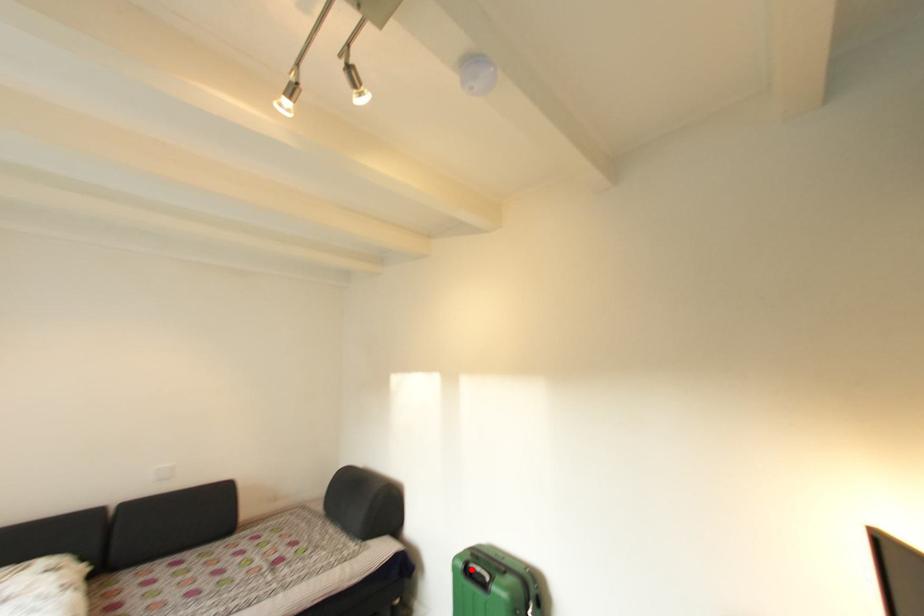
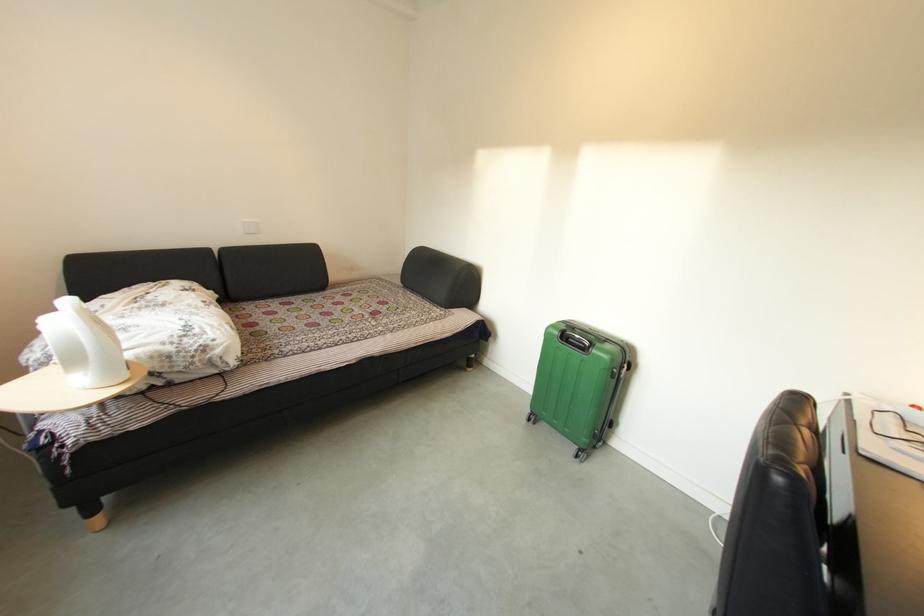
Find the pixel in the second image that matches the highlighted location in the first image.

(568, 336)